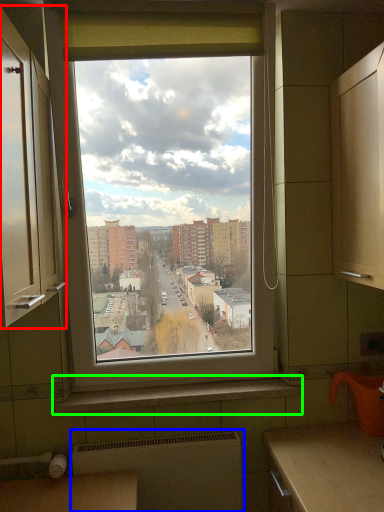
Question: Which is farther away from cabinetry (highlighted by a red box)? radiator (highlighted by a blue box) or window sill (highlighted by a green box)?

Choices:
 (A) radiator
 (B) window sill

Answer: (A)